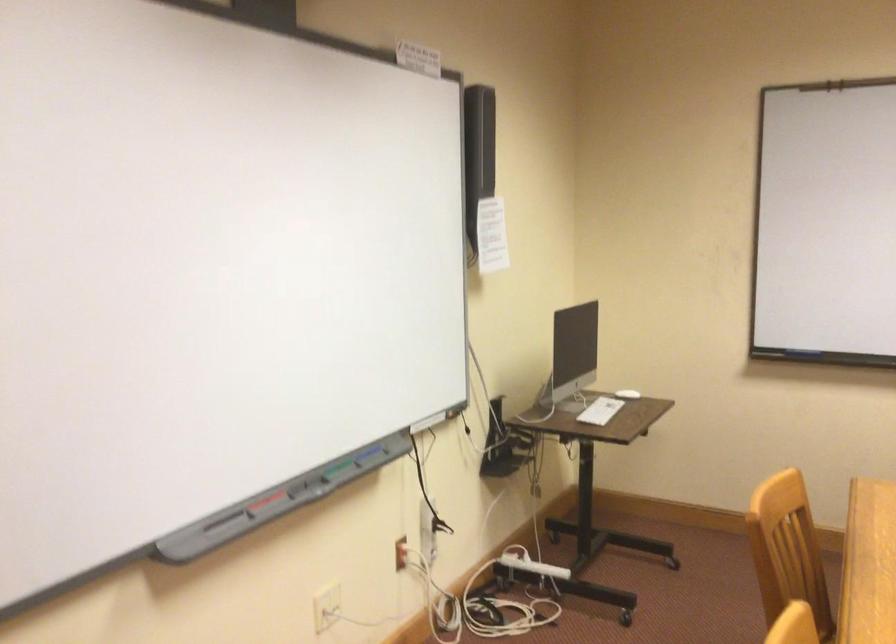
Which object does [368,453] point to?

This point indicates the blue whiteboard marker.